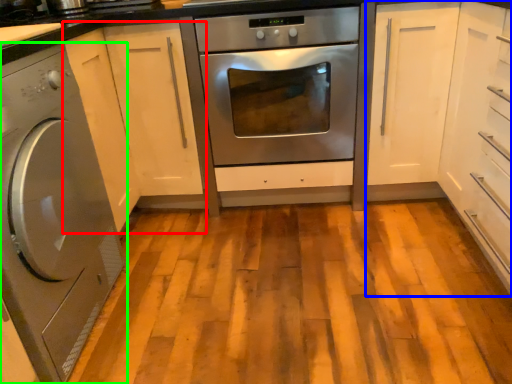
Question: Considering the real-world distances, which object is farthest from cabinetry (highlighted by a red box)? cabinetry (highlighted by a blue box) or washing machine (highlighted by a green box)?

Choices:
 (A) cabinetry
 (B) washing machine

Answer: (A)